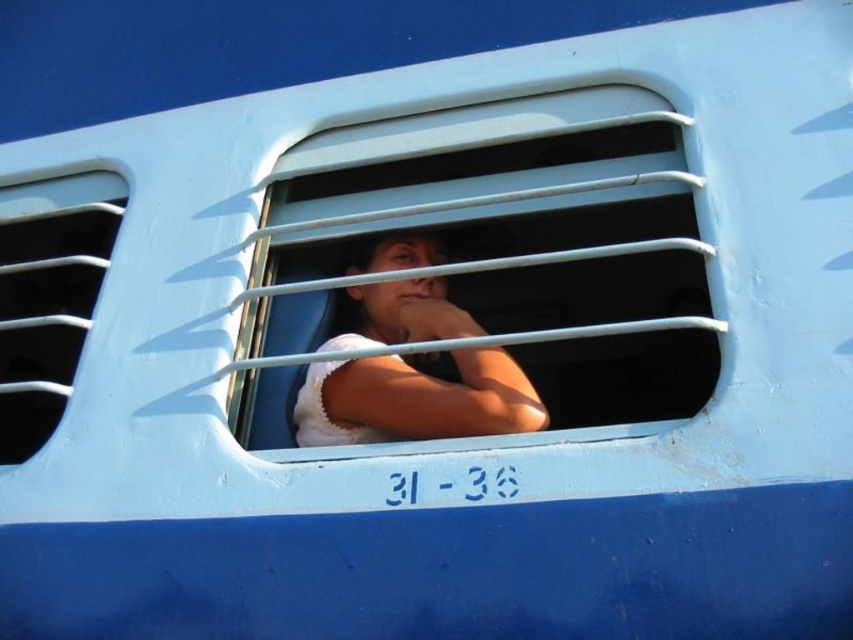
Is white metal window at center shorter than white matte shirt at center?

Incorrect, white metal window at center's height does not fall short of white matte shirt at center's.

Is point (289, 266) closer to viewer compared to point (424, 243)?

Yes, point (289, 266) is in front of point (424, 243).

At what (x,y) coordinates should I click in order to perform the action: click on white metal window at center. Please return your answer as a coordinate pair (x, y). Looking at the image, I should click on (505, 253).

Does white metal window at center have a larger size compared to white plastic vent at left?

Yes, white metal window at center is bigger than white plastic vent at left.

Is white metal window at center taller than white plastic vent at left?

No, white metal window at center is not taller than white plastic vent at left.

Who is more distant from viewer, (566, 380) or (30, 317)?

Positioned behind is point (566, 380).

At what (x,y) coordinates should I click in order to perform the action: click on white metal window at center. Please return your answer as a coordinate pair (x, y). The height and width of the screenshot is (640, 853). Looking at the image, I should click on (505, 253).

Does white matte shirt at center lie in front of white plastic vent at left?

Yes, white matte shirt at center is closer to the viewer.

What do you see at coordinates (415, 401) in the screenshot? I see `white matte shirt at center` at bounding box center [415, 401].

Locate an element on the screen. white matte shirt at center is located at coordinates (415, 401).